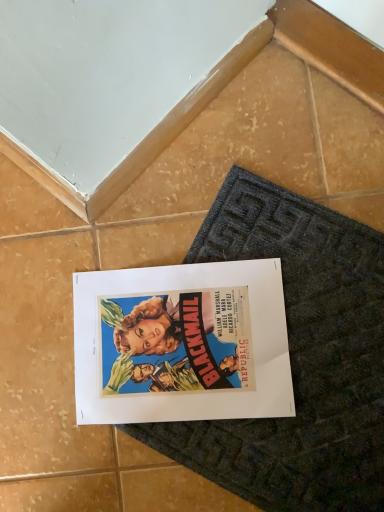
Identify the location of blank space situated above dark gray textured bath mat at center (from a real-world perspective). This screenshot has width=384, height=512. (281, 350).